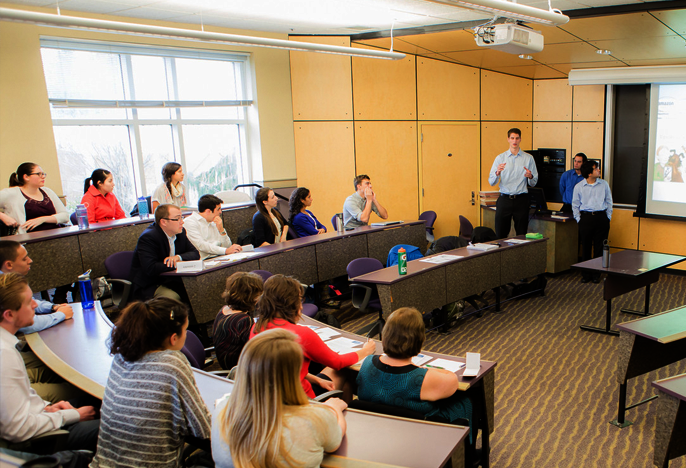
Locate an element on the screen. The height and width of the screenshot is (468, 686). window panels is located at coordinates (93, 78), (145, 75), (213, 80), (209, 147), (160, 139), (110, 143).